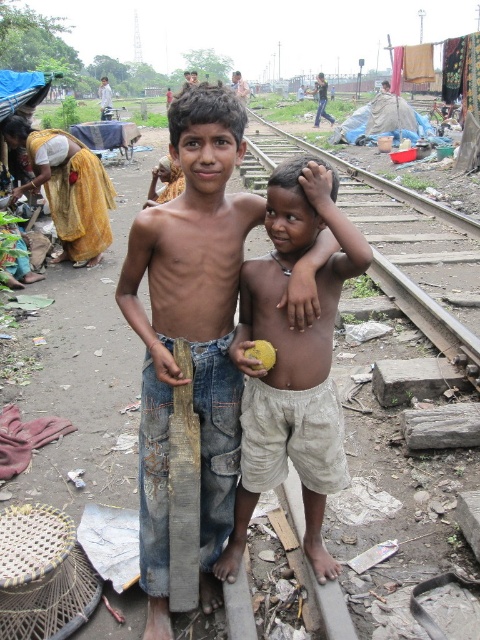
Does wooden plank at center have a lesser width compared to light beige shorts at center?

No, wooden plank at center is not thinner than light beige shorts at center.

Does wooden plank at center have a greater width compared to light beige shorts at center?

Correct, the width of wooden plank at center exceeds that of light beige shorts at center.

Find the location of a particular element. This screenshot has height=640, width=480. wooden plank at center is located at coordinates (190, 330).

Where is `wooden plank at center`? This screenshot has width=480, height=640. wooden plank at center is located at coordinates (190, 330).

Locate an element on the screen. wooden plank at center is located at coordinates (190, 330).

Who is higher up, wooden plank at center or metal train track at center?

metal train track at center is above.

Which is in front, point (164, 493) or point (347, 180)?

Point (164, 493)

What are the coordinates of `wooden plank at center` in the screenshot? It's located at (190, 330).

Between light beige shorts at center and yellow cotton sari at upper left, which one has less height?

With less height is light beige shorts at center.

Is point (243, 308) farther from camera compared to point (78, 204)?

No.

What do you see at coordinates (290, 358) in the screenshot? The image size is (480, 640). I see `light beige shorts at center` at bounding box center [290, 358].

Identify the location of light beige shorts at center. This screenshot has width=480, height=640. (290, 358).